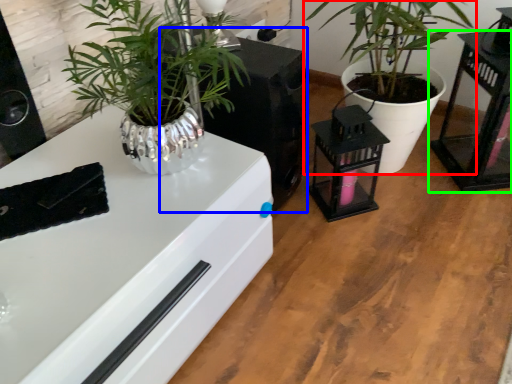
Question: Estimate the real-world distances between objects in this image. Which object is closer to houseplant (highlighted by a red box), appliance (highlighted by a blue box) or table (highlighted by a green box)?

Choices:
 (A) appliance
 (B) table

Answer: (B)